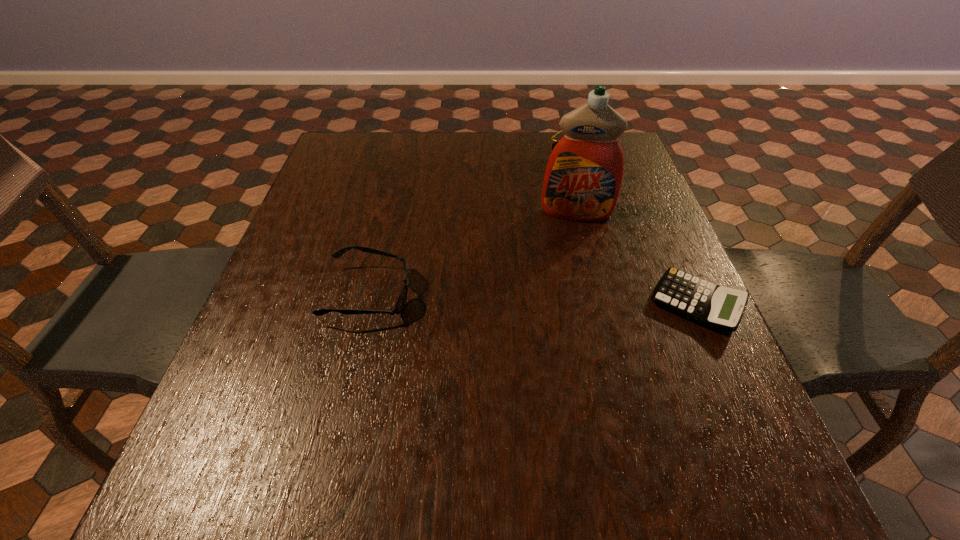
You are a GUI agent. You are given a task and a screenshot of the screen. Output one action in this format:
    pyautogui.click(x=<x>, y=<y>)
    Task: Click on the empty location between the detergent and the shortest object
    The height and width of the screenshot is (540, 960).
    Given the screenshot: What is the action you would take?
    pyautogui.click(x=636, y=258)

Where is `free space between the calculator and the second farthest object`? The height and width of the screenshot is (540, 960). free space between the calculator and the second farthest object is located at coordinates (636, 258).

Locate an element on the screen. blank region between the shortest object and the tallest object is located at coordinates (636, 258).

At what (x,y) coordinates should I click in order to perform the action: click on free space between the leftmost object and the third nearest object. Please return your answer as a coordinate pair (x, y). Looking at the image, I should click on (472, 253).

Identify which object is located as the second nearest to the left sunglasses. Please provide its 2D coordinates. Your answer should be formatted as a tuple, i.e. [(x, y)], where the tuple contains the x and y coordinates of a point satisfying the conditions above.

[(714, 306)]

The height and width of the screenshot is (540, 960). In order to click on object that ranks as the third closest to the tallest object in this screenshot , I will do `click(402, 297)`.

Locate an element on the screen. This screenshot has height=540, width=960. vacant space that satisfies the following two spatial constraints: 1. on the back side of the right sunglasses; 2. on the left side of the third nearest object is located at coordinates (562, 151).